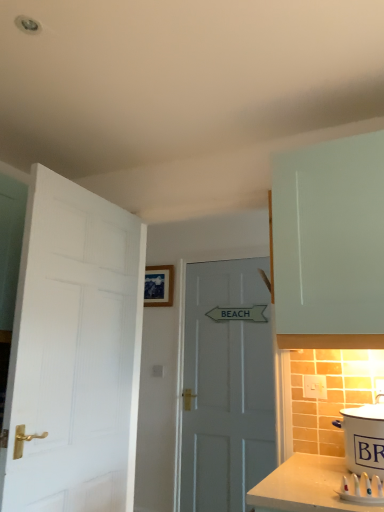
Question: From a real-world perspective, relative to white plastic electric outlet at lower right, is white plastic toothbrushes at lower right vertically above or below?

Choices:
 (A) above
 (B) below

Answer: (B)

Question: Is white plastic toothbrushes at lower right bigger or smaller than white plastic electric outlet at lower right?

Choices:
 (A) big
 (B) small

Answer: (A)

Question: Based on their relative distances, which object is farther from the white ceramic pot at lower right?

Choices:
 (A) white wooden door at center, arranged as the second door when viewed from the front
 (B) white matte door at left, arranged as the 2th door when viewed from the right
 (C) white plastic toothbrushes at lower right
 (D) white plastic electric outlet at lower right

Answer: (A)

Question: Which object is positioned farthest from the white matte door at left, the 1th door positioned from the left?

Choices:
 (A) white plastic electric outlet at lower right
 (B) white wooden door at center, which is the second door from left to right
 (C) white plastic toothbrushes at lower right
 (D) white ceramic pot at lower right

Answer: (B)